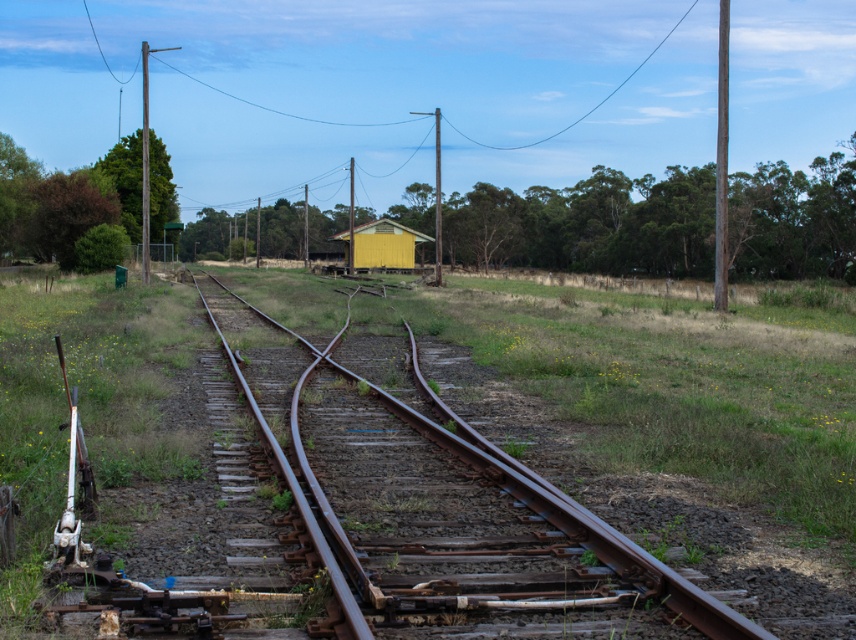
Question: Can you confirm if rusty metal track at center is thinner than yellow wood hut at center?

Choices:
 (A) yes
 (B) no

Answer: (A)

Question: Does rusty metal track at center have a smaller size compared to yellow wood hut at center?

Choices:
 (A) no
 (B) yes

Answer: (B)

Question: Which object is closer to the camera taking this photo?

Choices:
 (A) rusty metal track at center
 (B) yellow wood hut at center

Answer: (A)

Question: Does rusty metal track at center appear under yellow wood hut at center?

Choices:
 (A) yes
 (B) no

Answer: (A)